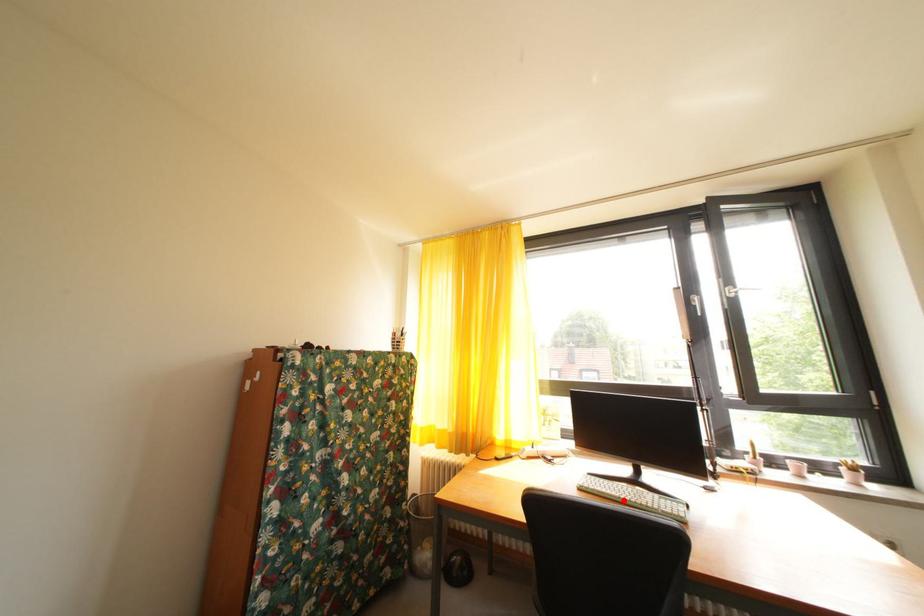
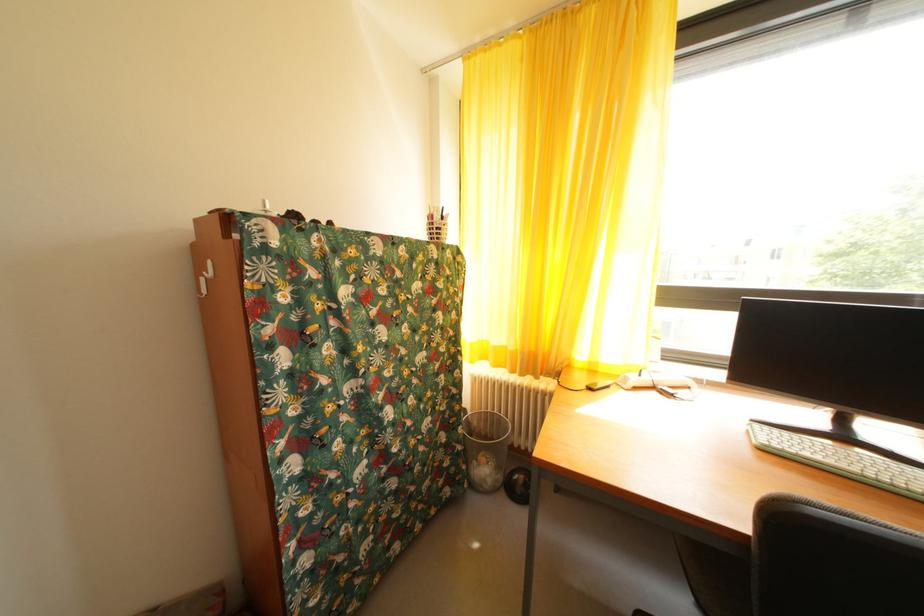
The point at the highlighted location is marked in the first image. Where is the corresponding point in the second image?

(854, 472)